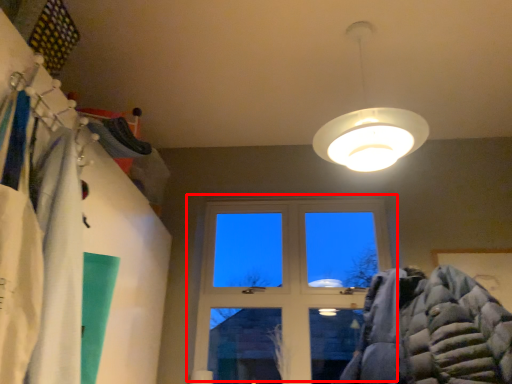
Question: From the image, what is the correct spatial relationship of window (annotated by the red box) in relation to lamp?

Choices:
 (A) left
 (B) right

Answer: (A)